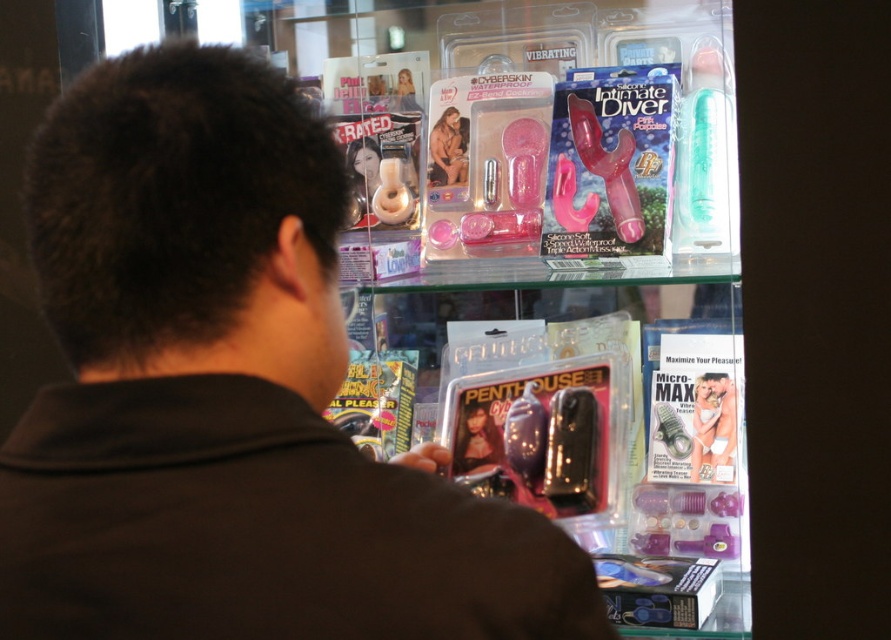
Does smooth plastic barbie at center lie behind matte plastic barbie at upper center?

That is False.

Is smooth plastic barbie at center positioned before matte plastic barbie at upper center?

Yes, it is.

Between point (718, 428) and point (462, 161), which one is positioned behind?

The point (462, 161) is behind.

The image size is (891, 640). I want to click on smooth plastic barbie at center, so click(713, 428).

This screenshot has width=891, height=640. What do you see at coordinates (229, 396) in the screenshot? I see `black matte shirt at upper left` at bounding box center [229, 396].

Is point (47, 250) positioned after point (724, 477)?

No, it is not.

The image size is (891, 640). I want to click on black matte shirt at upper left, so click(229, 396).

Which is in front, point (177, 147) or point (429, 170)?

Point (177, 147)

Between black matte shirt at upper left and matte plastic barbie at upper center, which one appears on the right side from the viewer's perspective?

From the viewer's perspective, matte plastic barbie at upper center appears more on the right side.

Who is more forward, (267, 163) or (443, 124)?

Point (267, 163)

This screenshot has width=891, height=640. I want to click on black matte shirt at upper left, so pos(229,396).